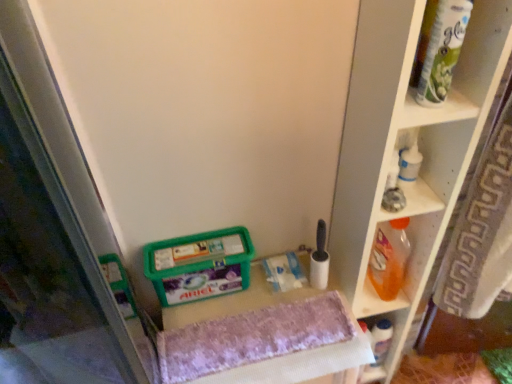
Where is `free space above green plastic container at lower center (from a real-world perspective)`? free space above green plastic container at lower center (from a real-world perspective) is located at coordinates (197, 248).